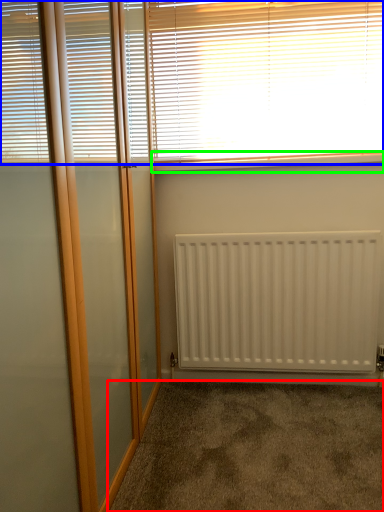
Question: Considering the real-world distances, which object is closest to corridor (highlighted by a red box)? window blind (highlighted by a blue box) or window sill (highlighted by a green box).

Choices:
 (A) window blind
 (B) window sill

Answer: (B)